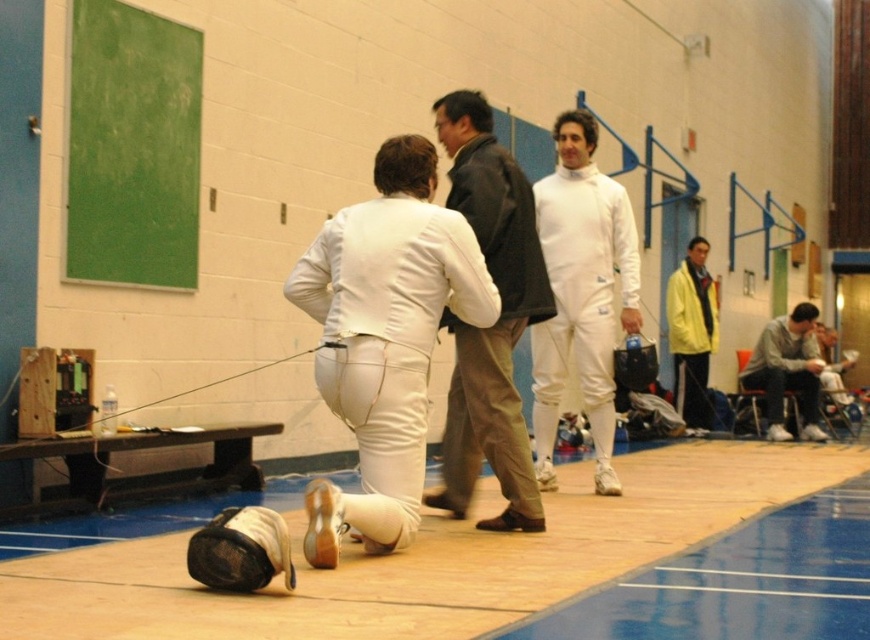
You are a coach observing a fencing practice session. You notice the white leather fencing suit at center and the gray cotton sweatshirt at right. Which piece of clothing is covering the other?

The white leather fencing suit at center is positioned over the gray cotton sweatshirt at right, so the white leather fencing suit is covering the gray cotton sweatshirt.